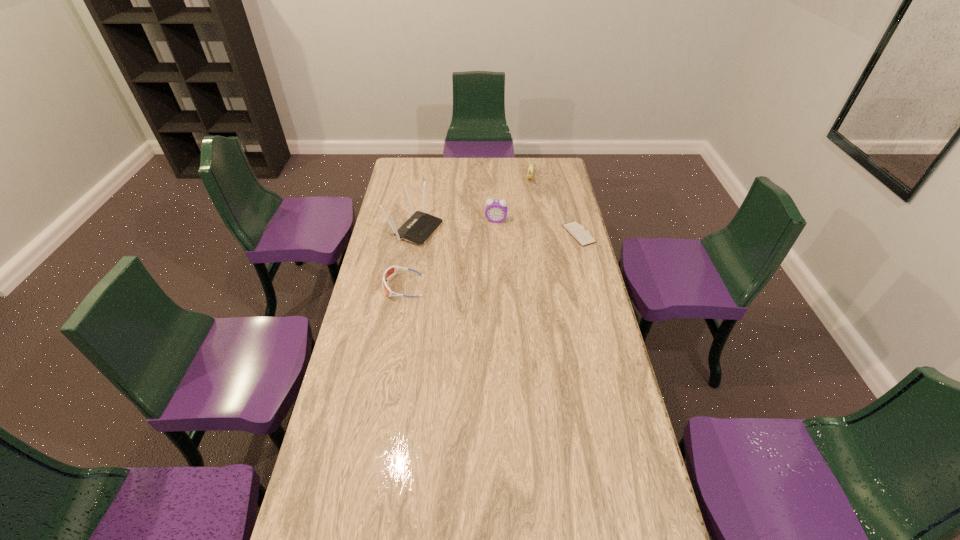
Where is `goggles`? The image size is (960, 540). goggles is located at coordinates (390, 271).

Where is `the fourth tallest object`? The width and height of the screenshot is (960, 540). the fourth tallest object is located at coordinates (390, 271).

You are a GUI agent. You are given a task and a screenshot of the screen. Output one action in this format:
    pyautogui.click(x=<x>, y=<y>)
    Task: Click on the rightmost object
    
    Given the screenshot: What is the action you would take?
    pyautogui.click(x=577, y=231)

Find the location of `the shortest object`. the shortest object is located at coordinates coord(577,231).

Locate an element on the screen. the second tallest object is located at coordinates (496, 210).

At what (x,y) coordinates should I click in order to perform the action: click on alarm clock. Please return your answer as a coordinate pair (x, y). This screenshot has width=960, height=540. Looking at the image, I should click on (496, 210).

Identify the location of the tallest object. [x=417, y=229].

Where is `the farthest object`? The height and width of the screenshot is (540, 960). the farthest object is located at coordinates (530, 170).

The width and height of the screenshot is (960, 540). Identify the location of banana. (530, 170).

You are a GUI agent. You are given a task and a screenshot of the screen. Output one action in this format:
    pyautogui.click(x=<x>, y=<y>)
    Task: Click on the vacant space located 0.070m on the front-facing side of the goggles
    
    Given the screenshot: What is the action you would take?
    pyautogui.click(x=366, y=286)